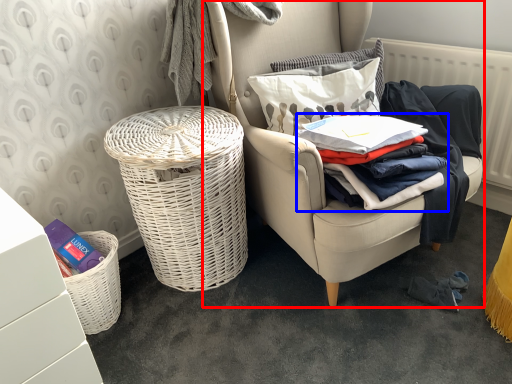
Question: Which object is closer to the camera taking this photo, chair (highlighted by a red box) or clothing (highlighted by a blue box)?

Choices:
 (A) chair
 (B) clothing

Answer: (A)